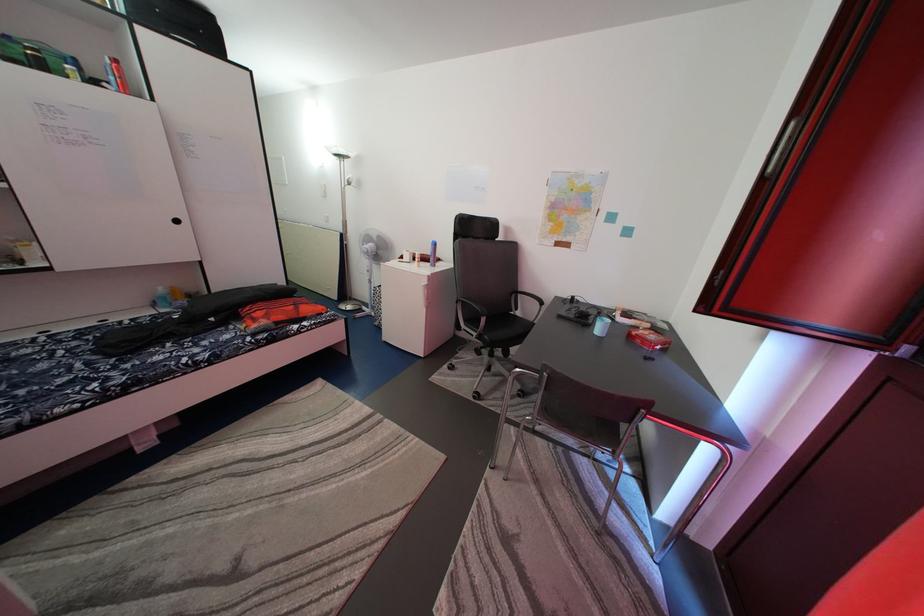
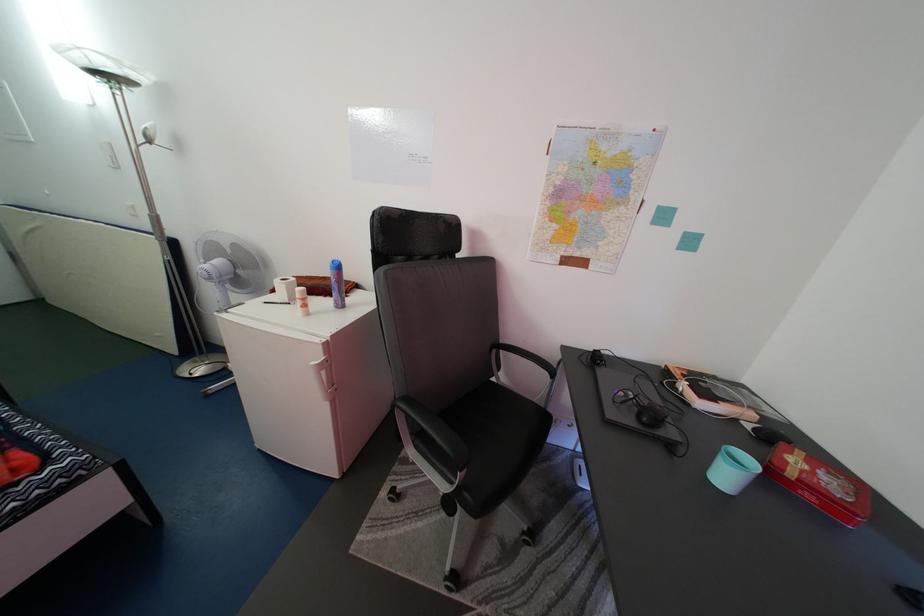
Find the pixel in the second image that matches pixel 387 244 in the first image.

(244, 253)